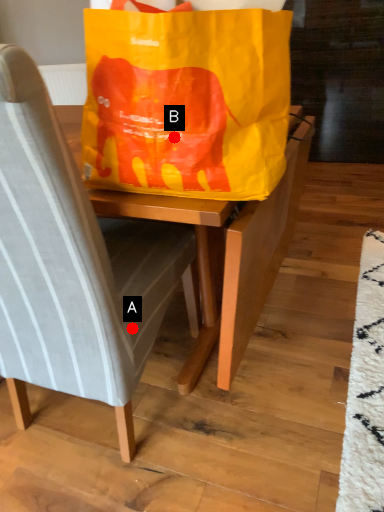
Question: Two points are circled on the image, labeled by A and B beside each circle. Which point is closer to the camera?

Choices:
 (A) A is closer
 (B) B is closer

Answer: (B)